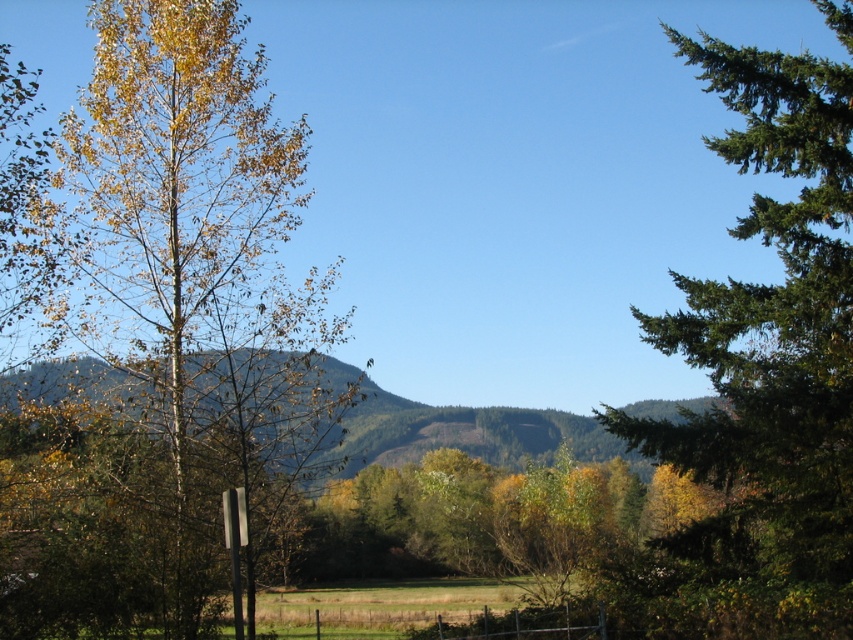
Is point (102, 288) closer to viewer compared to point (833, 604)?

No.

Is point (236, 234) positioned behind point (793, 257)?

Yes, point (236, 234) is behind point (793, 257).

What do you see at coordinates (192, 252) in the screenshot?
I see `yellow-green foliage at left` at bounding box center [192, 252].

I want to click on yellow-green foliage at left, so click(x=192, y=252).

Does green evergreen tree at right appear over green forested mountain at center?

Indeed, green evergreen tree at right is positioned over green forested mountain at center.

Can you confirm if green evergreen tree at right is wider than green forested mountain at center?

Incorrect, green evergreen tree at right's width does not surpass green forested mountain at center's.

This screenshot has width=853, height=640. Find the location of `green evergreen tree at right`. green evergreen tree at right is located at coordinates [763, 376].

The image size is (853, 640). What are the coordinates of `green evergreen tree at right` in the screenshot? It's located at click(763, 376).

Can you confirm if yellow-green foliage at left is positioned below green forested mountain at center?

No, yellow-green foliage at left is not below green forested mountain at center.

Can you confirm if yellow-green foliage at left is wider than green forested mountain at center?

No, yellow-green foliage at left is not wider than green forested mountain at center.

Who is more forward, (216,86) or (364,436)?

Point (216,86) is more forward.

This screenshot has width=853, height=640. I want to click on yellow-green foliage at left, so click(x=192, y=252).